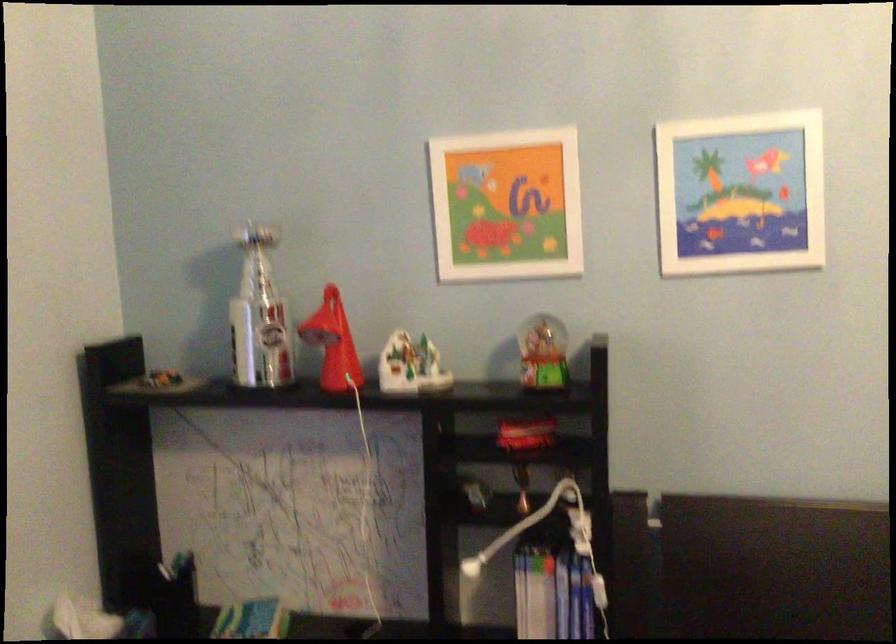
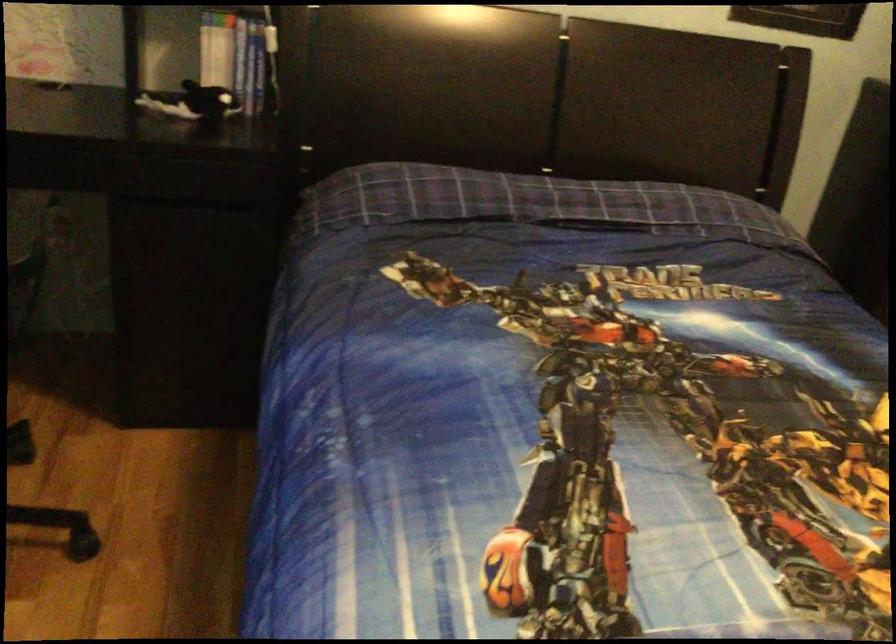
The first image is from the beginning of the video and the second image is from the end. How did the camera likely rotate when shooting the video?

The rotation direction of the camera is right-down.